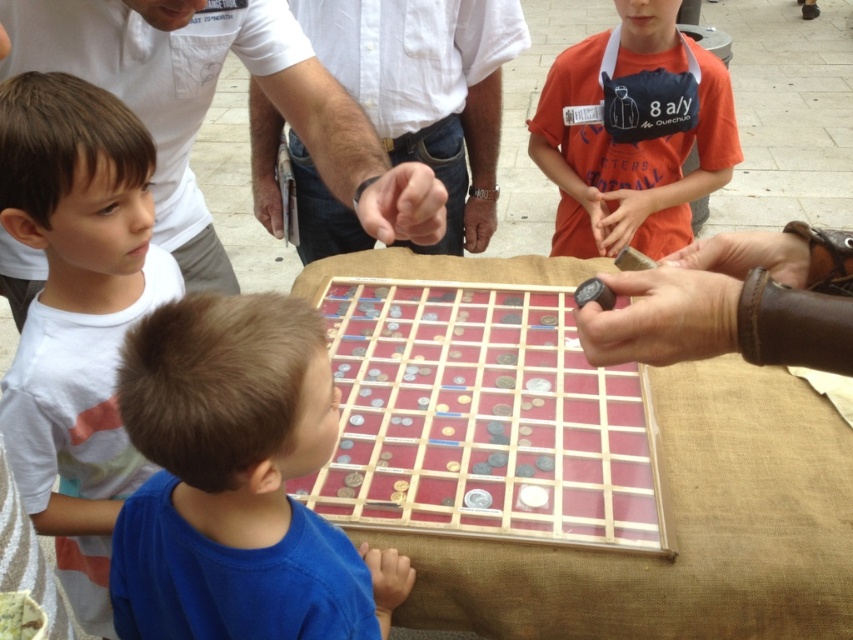
Question: Which of the following is the closest to the observer?

Choices:
 (A) white shirt at center
 (B) orange cotton shirt at upper right

Answer: (A)

Question: Which object appears farthest from the camera in this image?

Choices:
 (A) white shirt at upper center
 (B) orange cotton shirt at upper right
 (C) wooden grid at center

Answer: (B)

Question: Is white cotton shirt at left smaller than white shirt at center?

Choices:
 (A) yes
 (B) no

Answer: (A)

Question: Is white shirt at center wider than orange cotton shirt at upper right?

Choices:
 (A) no
 (B) yes

Answer: (B)

Question: Which point is closer to the camera?

Choices:
 (A) wooden grid at center
 (B) white cotton shirt at left
 (C) white shirt at center

Answer: (B)

Question: Where is white shirt at upper center located in relation to orange cotton shirt at upper right in the image?

Choices:
 (A) right
 (B) left

Answer: (B)